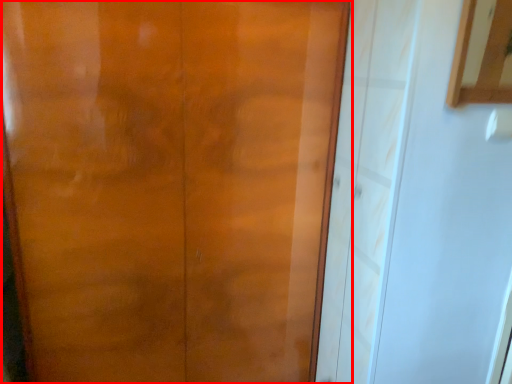
Question: From the image's perspective, where is door (annotated by the red box) located relative to cabinetry?

Choices:
 (A) above
 (B) below

Answer: (B)